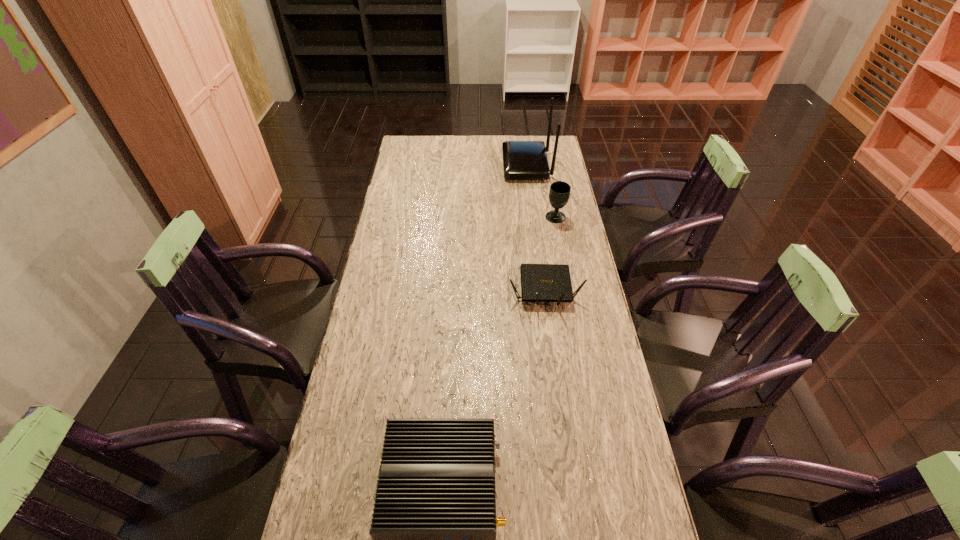
Where is `object that is the third closest to the second farthest object`? object that is the third closest to the second farthest object is located at coordinates (434, 523).

Identify which object is located as the second nearest to the tallest router. Please provide its 2D coordinates. Your answer should be formatted as a tuple, i.e. [(x, y)], where the tuple contains the x and y coordinates of a point satisfying the conditions above.

[(539, 282)]

Identify which router is located as the nearest to the third nearest object. Please provide its 2D coordinates. Your answer should be formatted as a tuple, i.e. [(x, y)], where the tuple contains the x and y coordinates of a point satisfying the conditions above.

[(522, 160)]

Identify which router is the second nearest to the farthest router. Please provide its 2D coordinates. Your answer should be formatted as a tuple, i.e. [(x, y)], where the tuple contains the x and y coordinates of a point satisfying the conditions above.

[(434, 523)]

Locate an element on the screen. The width and height of the screenshot is (960, 540). vacant region that satisfies the following two spatial constraints: 1. on the front-facing side of the tallest object; 2. on the left side of the second nearest router is located at coordinates (543, 290).

Identify the location of free point that satisfies the following two spatial constraints: 1. on the front-facing side of the farthest object; 2. on the right side of the second nearest router. point(543,290).